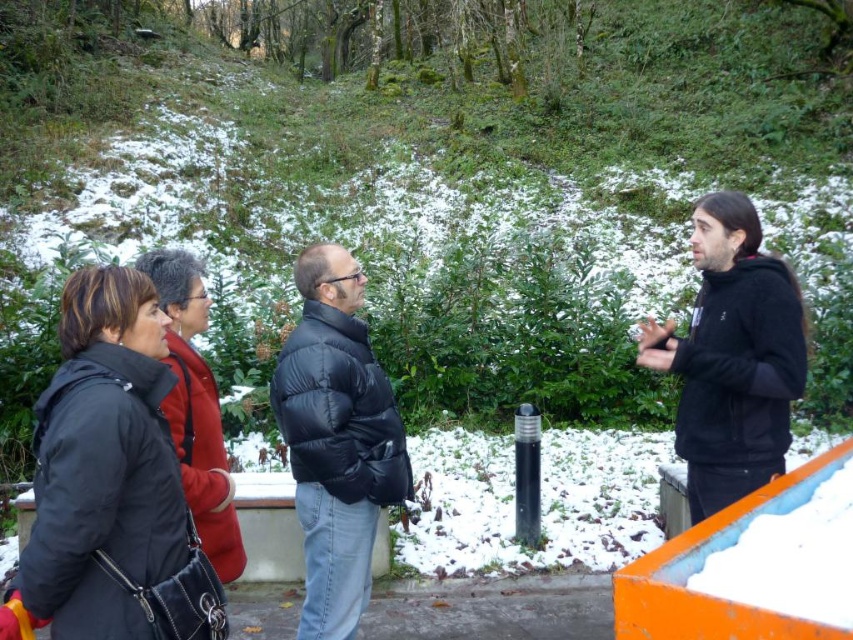
Can you confirm if black puffy jacket at center is smaller than matte black jacket at left?

No, black puffy jacket at center is not smaller than matte black jacket at left.

Image resolution: width=853 pixels, height=640 pixels. In order to click on black puffy jacket at center in this screenshot , I will do `click(335, 440)`.

You are a GUI agent. You are given a task and a screenshot of the screen. Output one action in this format:
    pyautogui.click(x=<x>, y=<y>)
    Task: Click on the black puffy jacket at center
    
    Given the screenshot: What is the action you would take?
    (335, 440)

What do you see at coordinates (335, 440) in the screenshot?
I see `black puffy jacket at center` at bounding box center [335, 440].

Is the position of black puffy jacket at center less distant than that of black hoodie at right?

No.

This screenshot has width=853, height=640. I want to click on black puffy jacket at center, so click(x=335, y=440).

At what (x,y) coordinates should I click in order to perform the action: click on black puffy jacket at center. Please return your answer as a coordinate pair (x, y). Image resolution: width=853 pixels, height=640 pixels. Looking at the image, I should click on (335, 440).

Is black matte jacket at lower left below black puffy jacket at center?

Incorrect, black matte jacket at lower left is not positioned below black puffy jacket at center.

Based on the photo, between black matte jacket at lower left and black puffy jacket at center, which one appears on the left side from the viewer's perspective?

black matte jacket at lower left is more to the left.

Find the location of `black matte jacket at lower left`. black matte jacket at lower left is located at coordinates (109, 483).